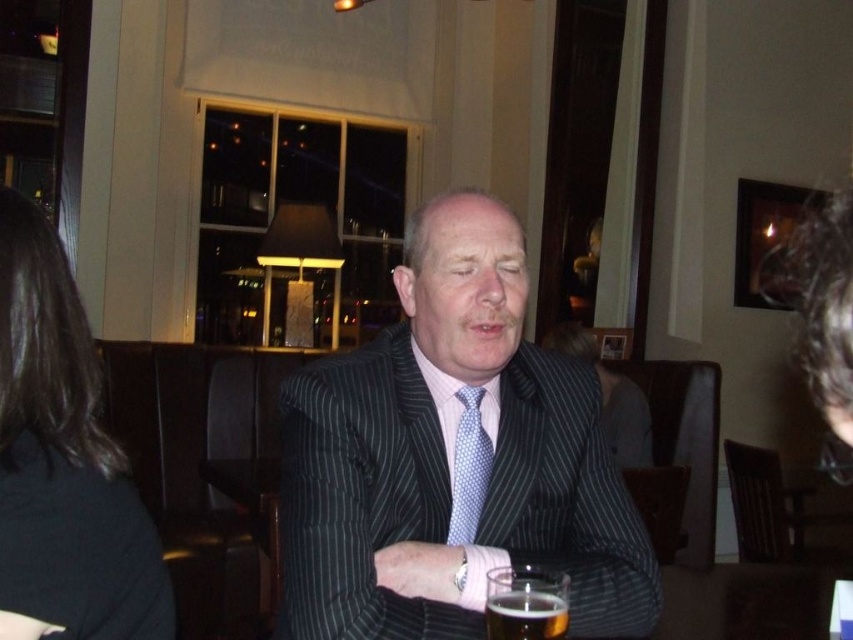
Question: Where is pinstriped suit at center located in relation to black fabric hair at left in the image?

Choices:
 (A) above
 (B) below

Answer: (B)

Question: Among these objects, which one is farthest from the camera?

Choices:
 (A) black fabric hair at left
 (B) blue dotted tie at center
 (C) clear glass at lower center

Answer: (B)

Question: Which of these objects is positioned farthest from the blue dotted tie at center?

Choices:
 (A) black fabric hair at left
 (B) clear glass at lower center

Answer: (A)

Question: Is black fabric hair at left further to the viewer compared to clear glass at lower center?

Choices:
 (A) yes
 (B) no

Answer: (B)

Question: Can you confirm if black fabric hair at left is positioned below clear glass at lower center?

Choices:
 (A) no
 (B) yes

Answer: (A)

Question: Which point is farther to the camera?

Choices:
 (A) (457, 531)
 (B) (624, 596)
 (C) (550, 634)
 (D) (42, 461)

Answer: (A)